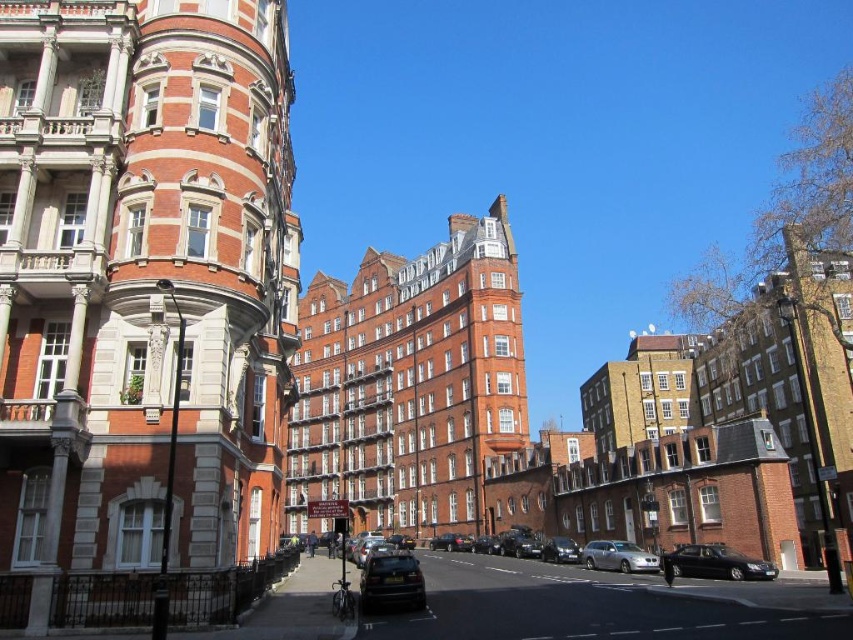
Does silver metallic car at center come in front of shiny silver car at center?

Yes.

Which is below, silver metallic car at center or shiny silver car at center?

shiny silver car at center is lower down.

Who is more forward, (643, 561) or (572, 561)?

Point (643, 561)

Where is `silver metallic car at center`? silver metallic car at center is located at coordinates (618, 556).

From the picture: Does shiny black sedan at lower right appear on the right side of silver metallic car at center?

Correct, you'll find shiny black sedan at lower right to the right of silver metallic car at center.

Does shiny black sedan at lower right have a greater width compared to silver metallic car at center?

Indeed, shiny black sedan at lower right has a greater width compared to silver metallic car at center.

Where is `shiny black sedan at lower right`? The image size is (853, 640). shiny black sedan at lower right is located at coordinates (717, 563).

You are a GUI agent. You are given a task and a screenshot of the screen. Output one action in this format:
    pyautogui.click(x=<x>, y=<y>)
    Task: Click on the shiny black sedan at lower right
    Image resolution: width=853 pixels, height=640 pixels.
    Given the screenshot: What is the action you would take?
    coord(717,563)

Who is shorter, shiny black car at lower center or shiny silver car at center?

shiny silver car at center is shorter.

Between shiny black car at lower center and shiny silver car at center, which one appears on the left side from the viewer's perspective?

shiny black car at lower center is more to the left.

The height and width of the screenshot is (640, 853). Identify the location of shiny black car at lower center. (392, 580).